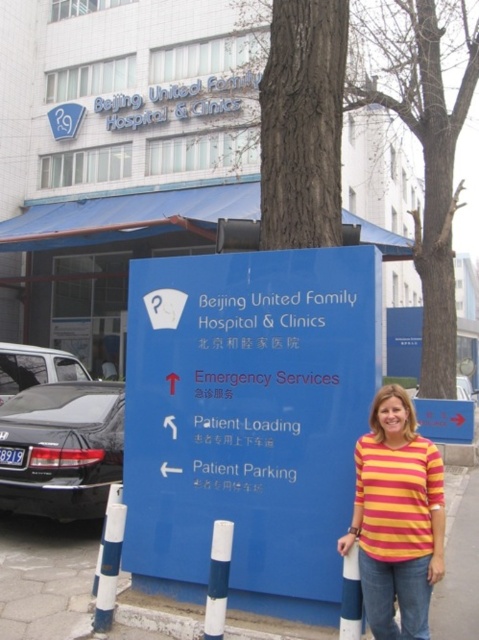
Question: Which object appears closest to the camera in this image?

Choices:
 (A) yellow-orange striped shirt at lower right
 (B) shiny black sedan at left
 (C) blue concrete pavement at lower center
 (D) blue plastic sign at center

Answer: (A)

Question: Can you confirm if blue plastic sign at center is positioned below blue concrete pavement at lower center?

Choices:
 (A) yes
 (B) no

Answer: (B)

Question: Among these objects, which one is farthest from the camera?

Choices:
 (A) bark at tree at upper center
 (B) shiny black sedan at left

Answer: (B)

Question: Is yellow-orange striped shirt at lower right positioned behind blue concrete pavement at lower center?

Choices:
 (A) yes
 (B) no

Answer: (B)

Question: Considering the relative positions of blue plastic sign at center and blue concrete pavement at lower center in the image provided, where is blue plastic sign at center located with respect to blue concrete pavement at lower center?

Choices:
 (A) right
 (B) left

Answer: (A)

Question: Estimate the real-world distances between objects in this image. Which object is closer to the bark at tree at upper center?

Choices:
 (A) yellow-orange striped shirt at lower right
 (B) blue concrete pavement at lower center

Answer: (A)